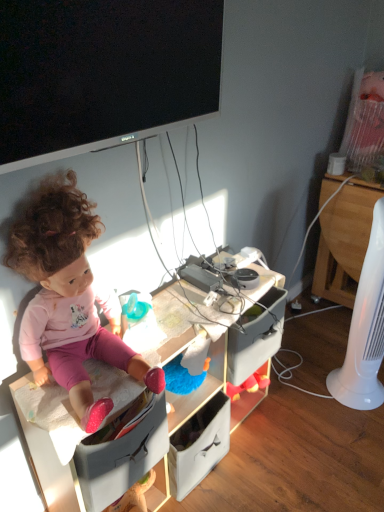
Question: From the image's perspective, would you say pink fabric doll at left is shown under black glossy flat-screen tv at upper center?

Choices:
 (A) no
 (B) yes

Answer: (B)

Question: Is pink fabric doll at left facing towards black glossy flat-screen tv at upper center?

Choices:
 (A) no
 (B) yes

Answer: (A)

Question: Considering the relative sizes of pink fabric doll at left and black glossy flat-screen tv at upper center in the image provided, is pink fabric doll at left bigger than black glossy flat-screen tv at upper center?

Choices:
 (A) no
 (B) yes

Answer: (B)

Question: Does pink fabric doll at left appear on the left side of black glossy flat-screen tv at upper center?

Choices:
 (A) yes
 (B) no

Answer: (A)

Question: Does pink fabric doll at left have a lesser height compared to black glossy flat-screen tv at upper center?

Choices:
 (A) yes
 (B) no

Answer: (B)

Question: Is pink fabric doll at left to the left or to the right of black glossy flat-screen tv at upper center in the image?

Choices:
 (A) right
 (B) left

Answer: (B)

Question: From their relative heights in the image, would you say pink fabric doll at left is taller or shorter than black glossy flat-screen tv at upper center?

Choices:
 (A) short
 (B) tall

Answer: (B)

Question: Considering the positions of pink fabric doll at left and black glossy flat-screen tv at upper center in the image, is pink fabric doll at left bigger or smaller than black glossy flat-screen tv at upper center?

Choices:
 (A) big
 (B) small

Answer: (A)

Question: Looking at their shapes, would you say pink fabric doll at left is wider or thinner than black glossy flat-screen tv at upper center?

Choices:
 (A) wide
 (B) thin

Answer: (A)

Question: Which is correct: black glossy flat-screen tv at upper center is inside pink fabric doll at left, or outside of it?

Choices:
 (A) inside
 (B) outside

Answer: (B)

Question: In the image, is black glossy flat-screen tv at upper center positioned in front of or behind pink fabric doll at left?

Choices:
 (A) behind
 (B) front

Answer: (B)

Question: Is black glossy flat-screen tv at upper center bigger or smaller than pink fabric doll at left?

Choices:
 (A) big
 (B) small

Answer: (B)

Question: From a real-world perspective, is black glossy flat-screen tv at upper center positioned above or below pink fabric doll at left?

Choices:
 (A) above
 (B) below

Answer: (A)

Question: Is point (327, 179) positioned closer to the camera than point (357, 311)?

Choices:
 (A) closer
 (B) farther

Answer: (B)

Question: Considering the positions of wooden at right and white plastic fan at right in the image, is wooden at right wider or thinner than white plastic fan at right?

Choices:
 (A) wide
 (B) thin

Answer: (A)